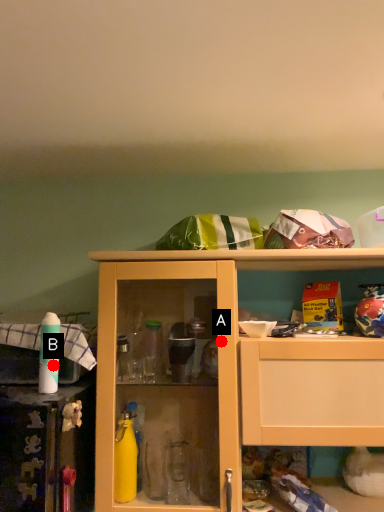
Question: Two points are circled on the image, labeled by A and B beside each circle. Which point is closer to the camera taking this photo?

Choices:
 (A) A is closer
 (B) B is closer

Answer: (B)